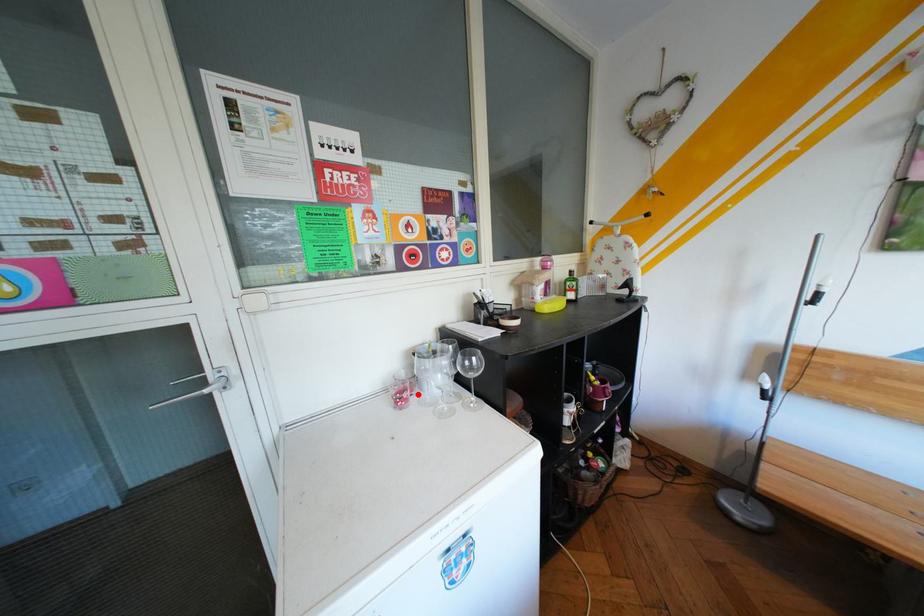
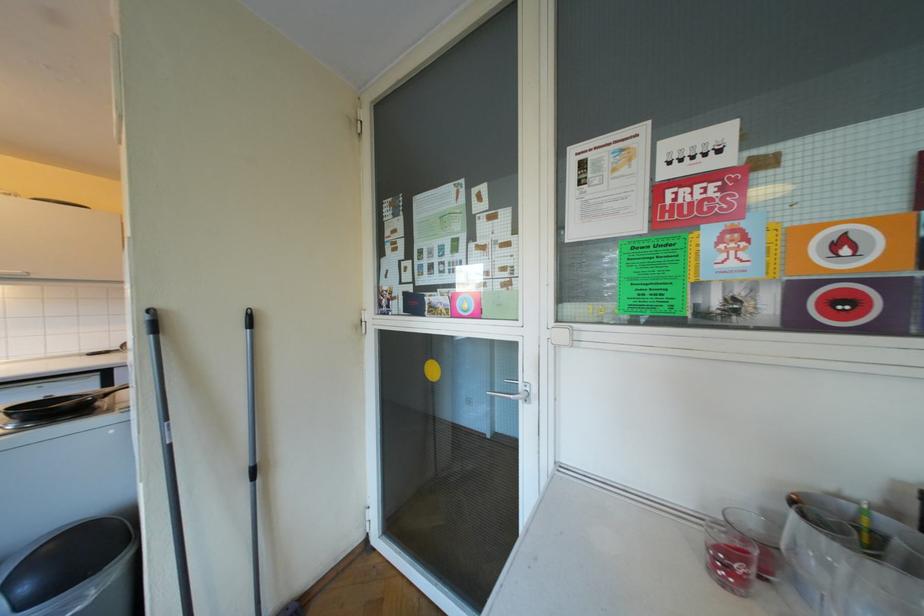
Locate, in the second image, the point that corresponds to the highlighted location in the first image.

(752, 567)